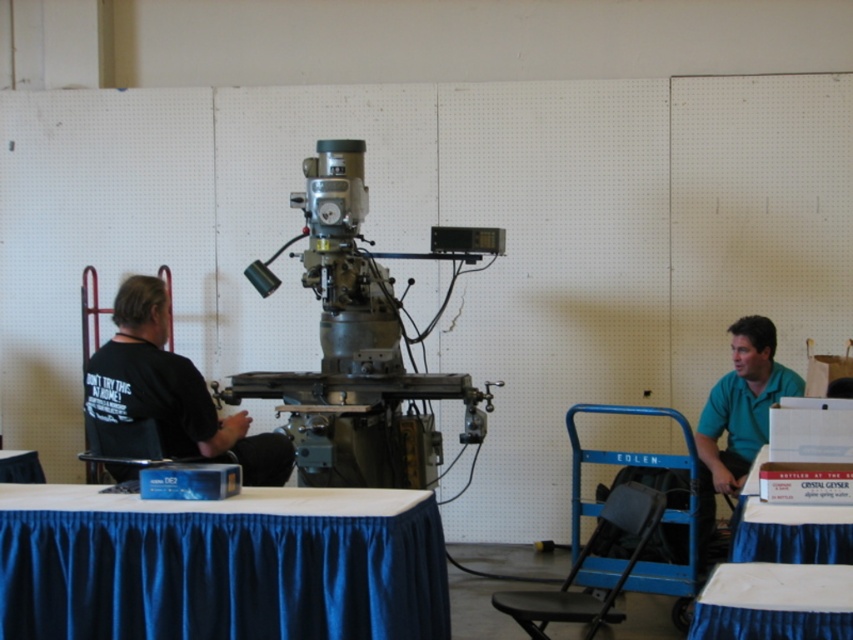
Does metallic gray machine at center have a greater height compared to black fabric shirt at left?

Yes.

Is metallic gray machine at center positioned behind black fabric shirt at left?

Yes, it is behind black fabric shirt at left.

Is point (322, 396) in front of point (170, 433)?

No, (322, 396) is further to viewer.

Identify the location of metallic gray machine at center. This screenshot has width=853, height=640. (361, 342).

Measure the distance between metallic gray machine at center and camera.

They are 4.73 meters apart.

Which is below, metallic gray machine at center or green matte shirt at right?

green matte shirt at right is lower down.

Is point (316, 241) farther from camera compared to point (730, 429)?

No, it is in front of (730, 429).

Find the location of a particular element. metallic gray machine at center is located at coordinates (361, 342).

Does black fabric shirt at left appear on the right side of green matte shirt at right?

Incorrect, black fabric shirt at left is not on the right side of green matte shirt at right.

Is point (192, 369) farther from camera compared to point (699, 524)?

No.

Image resolution: width=853 pixels, height=640 pixels. I want to click on black fabric shirt at left, so click(x=167, y=394).

Find the location of a particular element. The height and width of the screenshot is (640, 853). black fabric shirt at left is located at coordinates (167, 394).